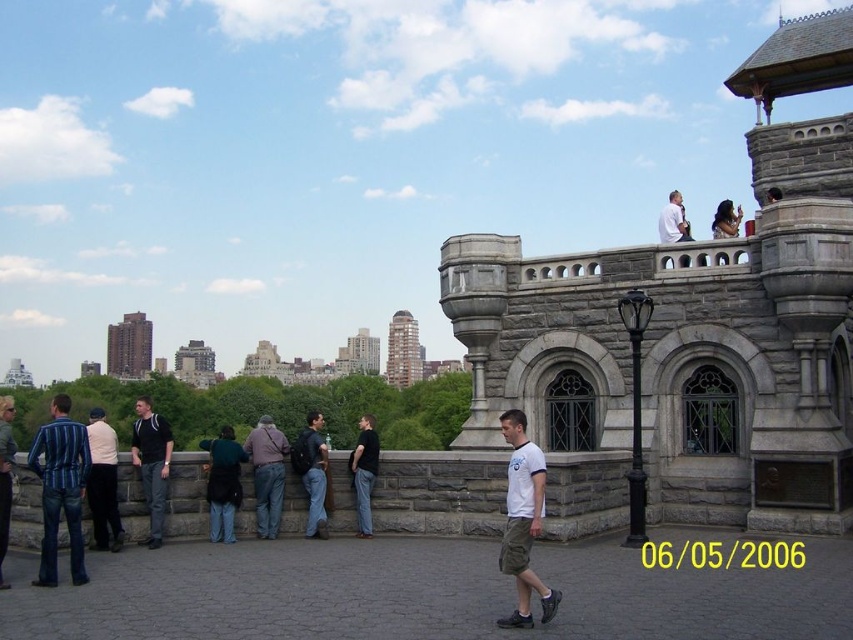
Question: Which is farther from the gray concrete building at left?

Choices:
 (A) white cotton t-shirt at center
 (B) dark gray jeans at center
 (C) dark gray backpack at center
 (D) dark blue jeans at center

Answer: (A)

Question: Can you confirm if brown brick building at center is bigger than white shirt at upper right?

Choices:
 (A) yes
 (B) no

Answer: (A)

Question: Is dark blue jeans at center bigger than dark gray backpack at center?

Choices:
 (A) yes
 (B) no

Answer: (B)

Question: Which object is closer to the camera taking this photo?

Choices:
 (A) dark gray jeans at center
 (B) white cotton t-shirt at center
 (C) matte black hair at upper center
 (D) gray stone fort at upper right

Answer: (B)

Question: Which object appears farthest from the camera in this image?

Choices:
 (A) gray stone fort at upper right
 (B) striped fabric shirt at left
 (C) light brown leather jacket at left
 (D) matte black hair at upper center

Answer: (D)

Question: Is dark gray jeans at center positioned before brown brick building at center?

Choices:
 (A) yes
 (B) no

Answer: (A)